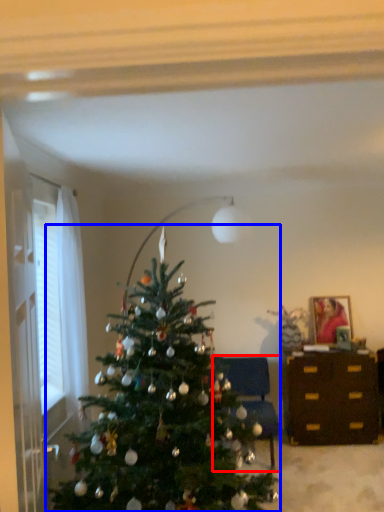
Question: Which object is closer to the camera taking this photo, furniture (highlighted by a red box) or christmas tree (highlighted by a blue box)?

Choices:
 (A) furniture
 (B) christmas tree

Answer: (B)